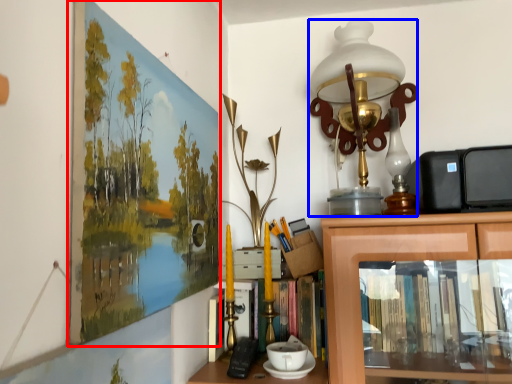
Question: Which point is closer to the camera, picture frame (highlighted by a red box) or table lamp (highlighted by a blue box)?

Choices:
 (A) picture frame
 (B) table lamp

Answer: (A)